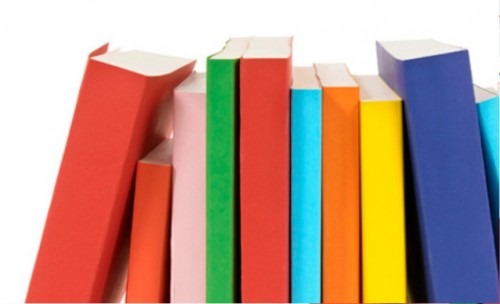
Locate an element on the screen. book cover is located at coordinates (84, 232), (151, 254), (189, 244), (217, 236), (266, 234), (309, 221), (340, 214), (382, 209), (442, 190), (489, 130).